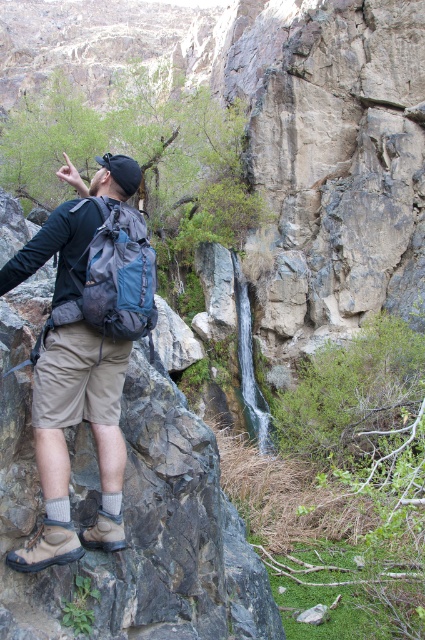
Question: Is matte blue backpack at center thinner than matte blue backpack at left?

Choices:
 (A) no
 (B) yes

Answer: (A)

Question: Which point is closer to the camera?

Choices:
 (A) (11, 266)
 (B) (116, 243)

Answer: (A)

Question: Which of the following is the farthest from the observer?

Choices:
 (A) matte blue backpack at center
 (B) matte blue backpack at left

Answer: (B)

Question: Is matte blue backpack at center bigger than matte blue backpack at left?

Choices:
 (A) yes
 (B) no

Answer: (A)

Question: Does matte blue backpack at center have a smaller size compared to matte blue backpack at left?

Choices:
 (A) yes
 (B) no

Answer: (B)